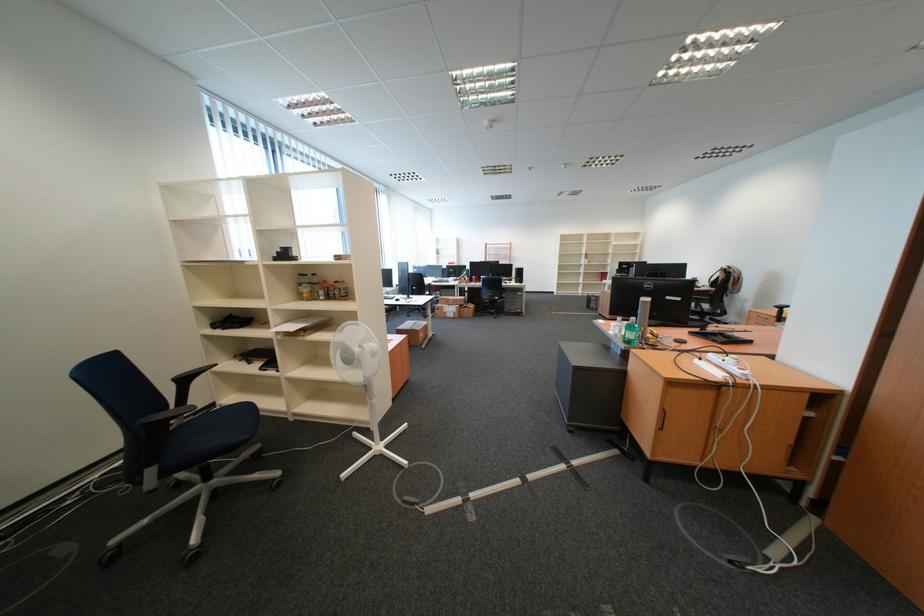
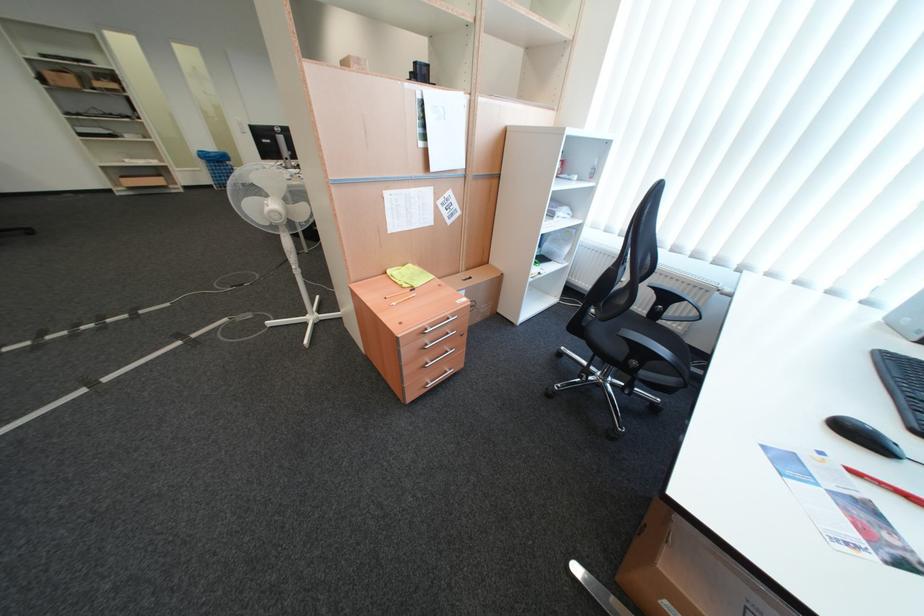
Find the pixel in the second image that matches (409,301) in the first image.

(864, 434)